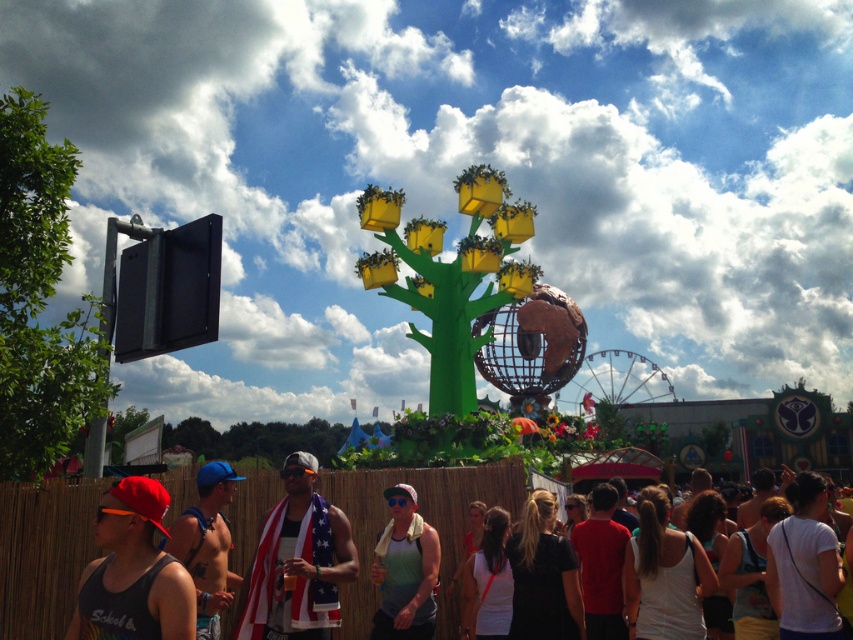
Question: Where is green matte tree at left located in relation to green matte tank top at center in the image?

Choices:
 (A) right
 (B) left

Answer: (B)

Question: Which point appears closest to the camera in this image?

Choices:
 (A) (425, 611)
 (B) (16, 147)
 (C) (259, 608)

Answer: (B)

Question: Which point appears farthest from the camera in this image?

Choices:
 (A) (381, 561)
 (B) (16, 340)
 (C) (149, 486)
 (D) (253, 604)

Answer: (A)

Question: Which object is closer to the camera taking this photo?

Choices:
 (A) american flag towel at center
 (B) matte black tank top at lower left
 (C) shiny blue cap at center

Answer: (B)

Question: Is american flag towel at center smaller than green matte tank top at center?

Choices:
 (A) yes
 (B) no

Answer: (B)

Question: Does green matte tree at left have a larger size compared to american flag towel at center?

Choices:
 (A) yes
 (B) no

Answer: (A)